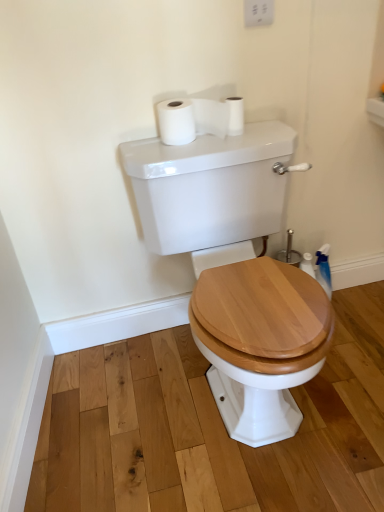
Where is `free space in front of white matte toilet paper at upper center, which ranks as the second toilet paper in left-to-right order`? The image size is (384, 512). free space in front of white matte toilet paper at upper center, which ranks as the second toilet paper in left-to-right order is located at coordinates (234, 141).